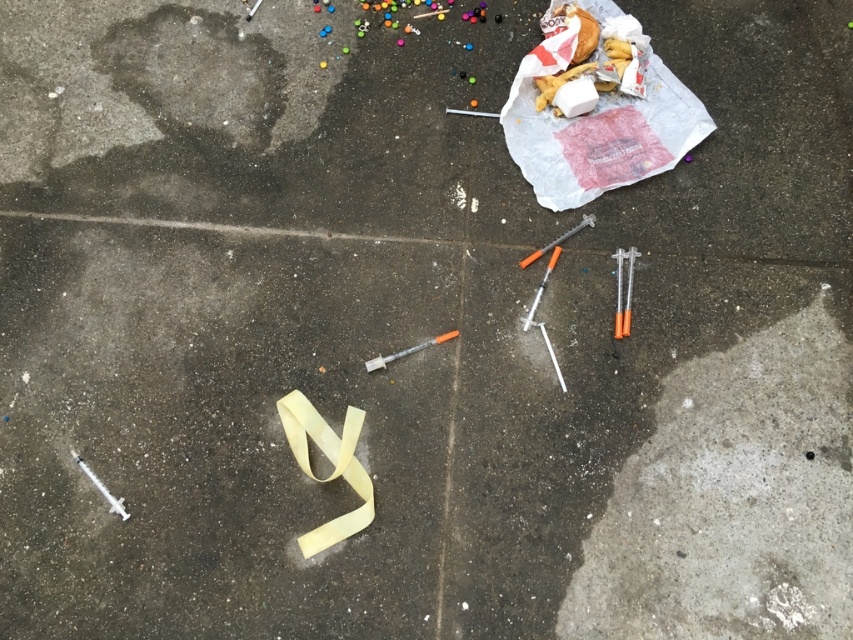
From the picture: You are a sanitation worker tasked with cleaning up the area. You need to pick up the translucent plastic syringe at center right and the white plastic syringe at lower left. Which syringe should you pick up first if you want to handle the larger one first?

The translucent plastic syringe at center right is larger than the white plastic syringe at lower left, so you should pick up the translucent plastic syringe at center right first.

You are standing on the concrete surface and want to place a heavy object without it sinking. Which area would be the most stable? The smooth concrete at bottom right or the wet ground near the burger and fries?

The smooth concrete at bottom right is 5.25 feet from viewer, so it is more stable and less likely to sink compared to the wet ground near the burger and fries.

You are a sanitation worker tasked with collecting medical waste. You see the translucent plastic syringe at center right and the white plastic syringe at lower left. Which one is taller?

The translucent plastic syringe at center right is taller than the white plastic syringe at lower left.